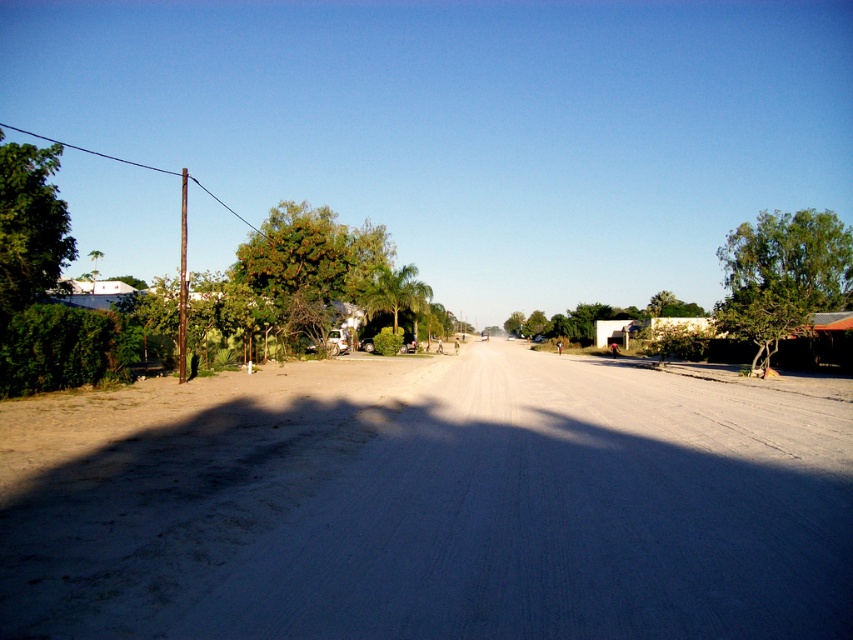
Does point (489, 392) come farther from viewer compared to point (53, 216)?

That is False.

Between gray gravel road at center and green leafy tree at left, which one is positioned lower?

gray gravel road at center

The image size is (853, 640). In order to click on gray gravel road at center in this screenshot , I will do (451, 515).

The height and width of the screenshot is (640, 853). Find the location of `gray gravel road at center`. gray gravel road at center is located at coordinates (451, 515).

Between green leafy tree at right and green leafy tree at left, which one appears on the right side from the viewer's perspective?

green leafy tree at right is more to the right.

Who is lower down, green leafy tree at right or green leafy tree at left?

green leafy tree at left

Image resolution: width=853 pixels, height=640 pixels. I want to click on green leafy tree at right, so click(782, 275).

You are a GUI agent. You are given a task and a screenshot of the screen. Output one action in this format:
    pyautogui.click(x=<x>, y=<y>)
    Task: Click on the green leafy tree at right
    The width and height of the screenshot is (853, 640).
    Given the screenshot: What is the action you would take?
    (x=782, y=275)

Between gray gravel road at center and green leafy tree at right, which one appears on the right side from the viewer's perspective?

green leafy tree at right

Between point (0, 620) and point (769, 275), which one is positioned in front?

Point (0, 620) is in front.

Image resolution: width=853 pixels, height=640 pixels. Describe the element at coordinates (451, 515) in the screenshot. I see `gray gravel road at center` at that location.

Find the location of a particular element. gray gravel road at center is located at coordinates (451, 515).